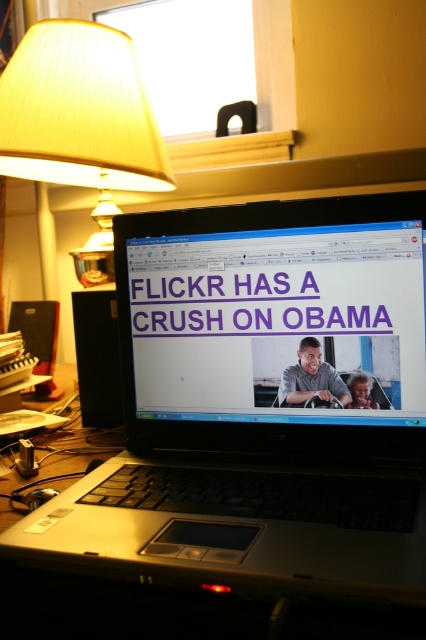
Can you confirm if silver/black plastic laptop at center is positioned below matte black laptop at center?

Yes.

The height and width of the screenshot is (640, 426). Describe the element at coordinates (261, 404) in the screenshot. I see `silver/black plastic laptop at center` at that location.

Which is behind, point (155, 221) or point (262, 284)?

Positioned behind is point (155, 221).

The image size is (426, 640). What are the coordinates of `silver/black plastic laptop at center` in the screenshot? It's located at (261, 404).

Is matte black laptop at center to the left of yellow pleated fabric lampshade at upper left from the viewer's perspective?

In fact, matte black laptop at center is to the right of yellow pleated fabric lampshade at upper left.

Is matte black laptop at center shorter than yellow pleated fabric lampshade at upper left?

Yes, matte black laptop at center is shorter than yellow pleated fabric lampshade at upper left.

Is point (391, 417) behind point (106, 77)?

No.

The height and width of the screenshot is (640, 426). Identify the location of matte black laptop at center. (275, 310).

From the picture: Does silver/black plastic laptop at center have a larger size compared to matte plastic steering wheel at center?

Correct, silver/black plastic laptop at center is larger in size than matte plastic steering wheel at center.

Which is more to the left, silver/black plastic laptop at center or matte plastic steering wheel at center?

From the viewer's perspective, silver/black plastic laptop at center appears more on the left side.

Which is in front, point (158, 576) or point (302, 369)?

Point (158, 576) is in front.

Find the location of `silver/black plastic laptop at center`. silver/black plastic laptop at center is located at coordinates (261, 404).